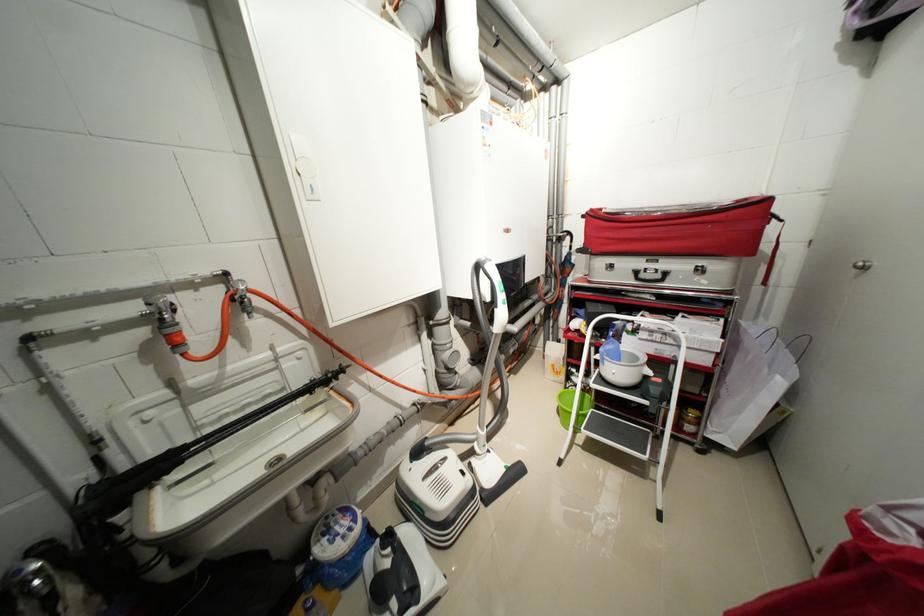
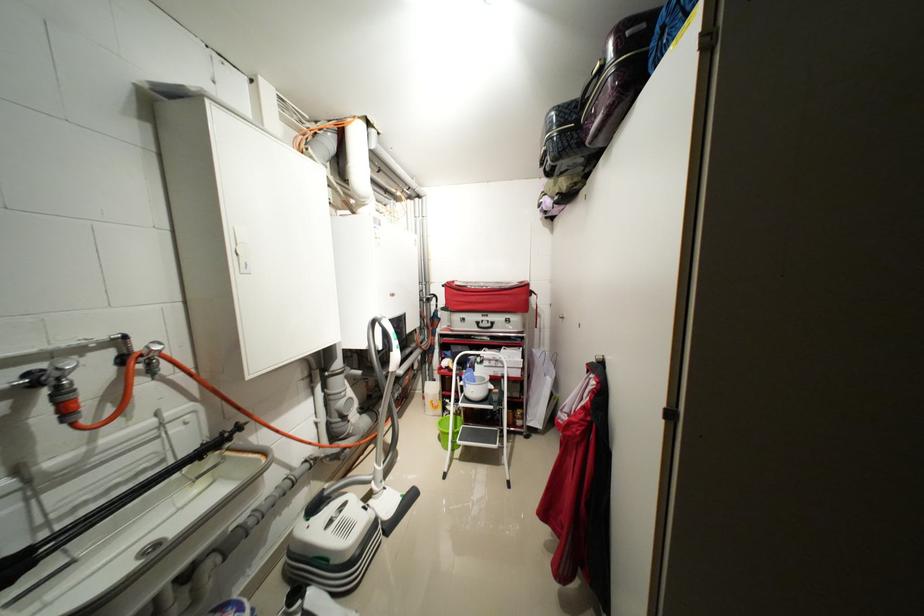
Find the pixel in the second image that matches point 706,424 in the first image.

(530, 418)